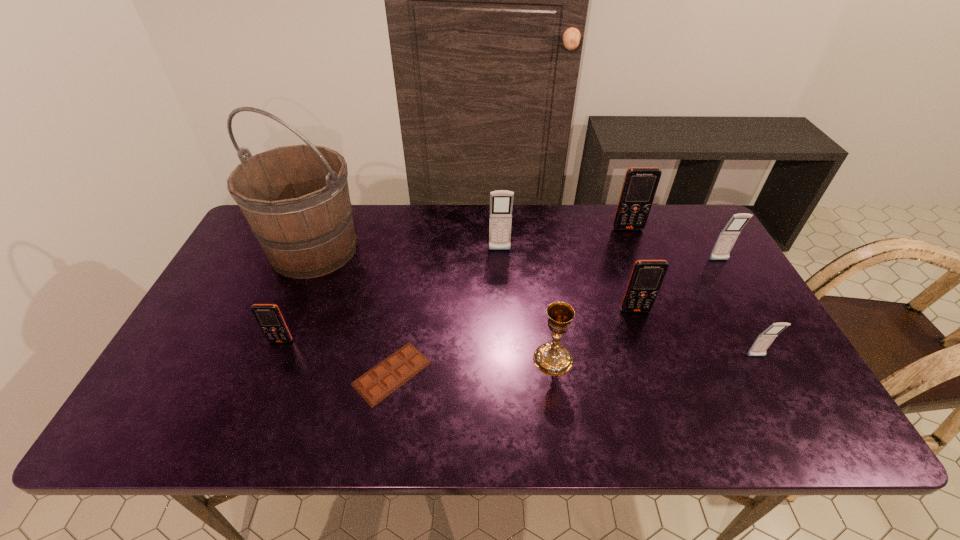
I want to click on gray cellular telephone identified as the closest to the leftmost cellular telephone, so click(x=501, y=201).

Locate which orange cellular telephone is the second closest to the nearest cellular telephone. Please provide its 2D coordinates. Your answer should be formatted as a tuple, i.e. [(x, y)], where the tuple contains the x and y coordinates of a point satisfying the conditions above.

[(640, 184)]

Point out which orange cellular telephone is positioned as the nearest to the fourth farthest cellular telephone. Please provide its 2D coordinates. Your answer should be formatted as a tuple, i.e. [(x, y)], where the tuple contains the x and y coordinates of a point satisfying the conditions above.

[(640, 184)]

I want to click on vacant space that satisfies the following two spatial constraints: 1. on the screen of the third object from left to right; 2. on the left side of the nearest orange cellular telephone, so pyautogui.click(x=268, y=373).

Find the location of `vacant space that satisfies the following two spatial constraints: 1. on the screen of the fifth object from right to left; 2. on the left side of the leftmost orange cellular telephone`. vacant space that satisfies the following two spatial constraints: 1. on the screen of the fifth object from right to left; 2. on the left side of the leftmost orange cellular telephone is located at coordinates (274, 359).

Find the location of `vacant space that satisfies the following two spatial constraints: 1. on the front side of the chalice; 2. on the right side of the bucket`. vacant space that satisfies the following two spatial constraints: 1. on the front side of the chalice; 2. on the right side of the bucket is located at coordinates (268, 359).